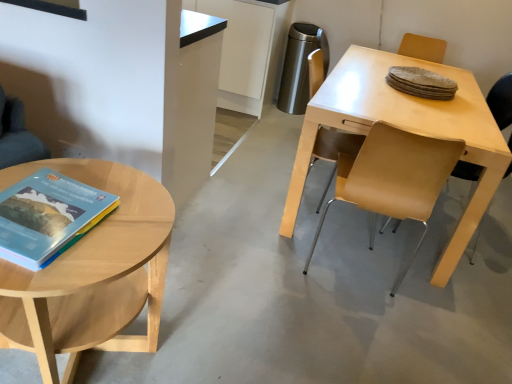
The image size is (512, 384). I want to click on free spot above light wood table at right (from a real-world perspective), so click(406, 96).